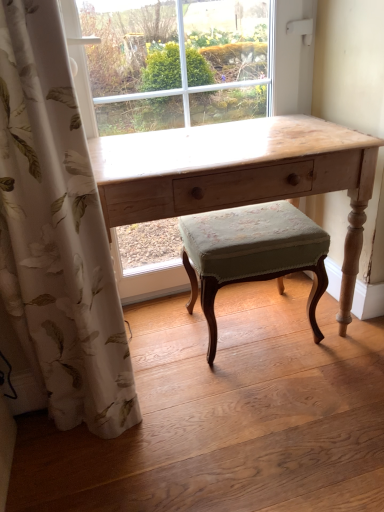
The image size is (384, 512). I want to click on vacant space to the right of white floral fabric curtain at left, so click(x=187, y=437).